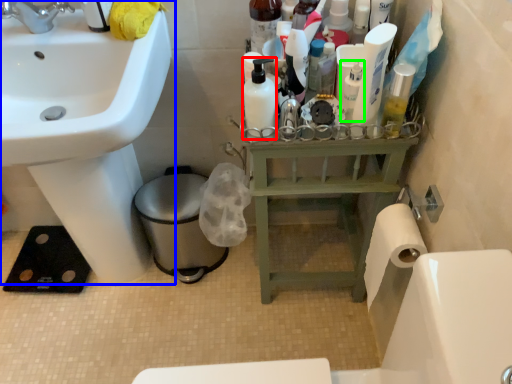
Question: Estimate the real-world distances between objects in this image. Which object is closer to mouthwash (highlighted by a red box), sink (highlighted by a blue box) or toiletry (highlighted by a green box)?

Choices:
 (A) sink
 (B) toiletry

Answer: (B)